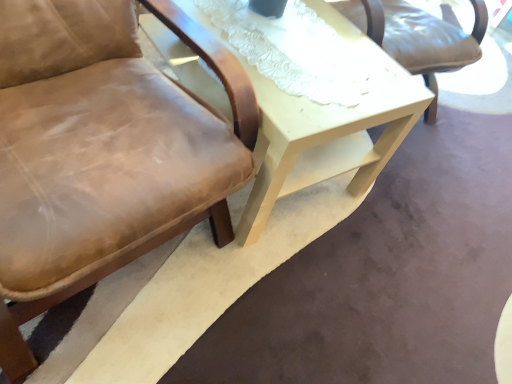
Question: From the image's perspective, is light beige wood table at center beneath brown leather chair at left?

Choices:
 (A) yes
 (B) no

Answer: (B)

Question: Considering the relative positions of light beige wood table at center and brown leather chair at left in the image provided, is light beige wood table at center in front of brown leather chair at left?

Choices:
 (A) no
 (B) yes

Answer: (A)

Question: From a real-world perspective, does light beige wood table at center sit lower than brown leather chair at left?

Choices:
 (A) yes
 (B) no

Answer: (A)

Question: Does light beige wood table at center have a lesser height compared to brown leather chair at left?

Choices:
 (A) no
 (B) yes

Answer: (B)

Question: Is light beige wood table at center smaller than brown leather chair at left?

Choices:
 (A) yes
 (B) no

Answer: (A)

Question: Considering the relative sizes of light beige wood table at center and brown leather chair at left in the image provided, is light beige wood table at center taller than brown leather chair at left?

Choices:
 (A) no
 (B) yes

Answer: (A)

Question: Would you say brown leather chair at left contains light beige wood table at center?

Choices:
 (A) no
 (B) yes

Answer: (A)

Question: From the image's perspective, is brown leather chair at left under light beige wood table at center?

Choices:
 (A) no
 (B) yes

Answer: (B)

Question: Is brown leather chair at left not inside light beige wood table at center?

Choices:
 (A) no
 (B) yes

Answer: (B)

Question: Is brown leather chair at left thinner than light beige wood table at center?

Choices:
 (A) no
 (B) yes

Answer: (B)

Question: Does brown leather chair at left have a greater width compared to light beige wood table at center?

Choices:
 (A) no
 (B) yes

Answer: (A)

Question: Considering the relative positions of brown leather chair at left and light beige wood table at center in the image provided, is brown leather chair at left in front of light beige wood table at center?

Choices:
 (A) yes
 (B) no

Answer: (A)

Question: Visually, is brown leather chair at left positioned to the left or to the right of light beige wood table at center?

Choices:
 (A) left
 (B) right

Answer: (A)